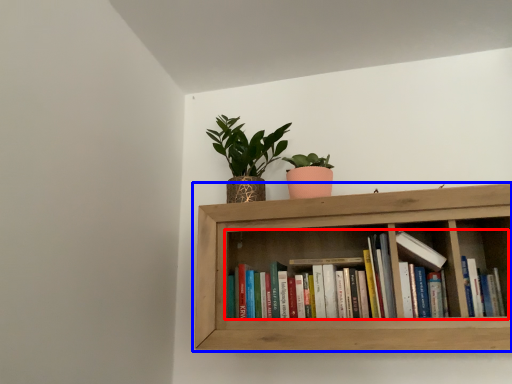
Question: Which object appears closest to the camera in this image, book (highlighted by a red box) or shelf (highlighted by a blue box)?

Choices:
 (A) book
 (B) shelf

Answer: (B)